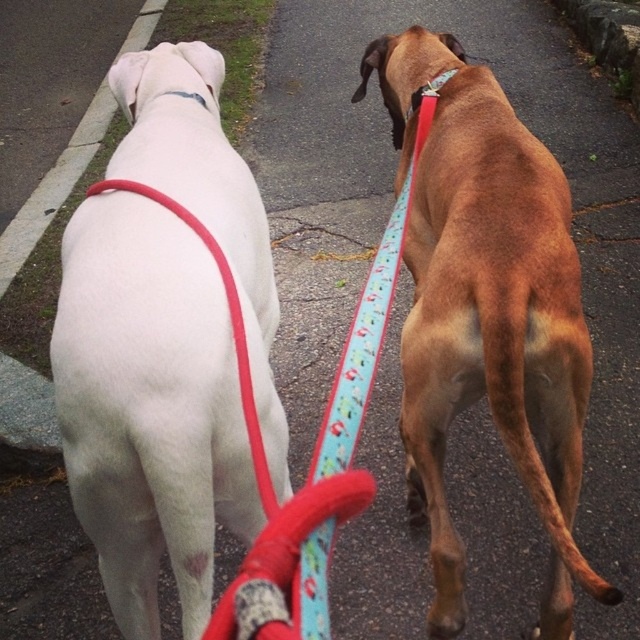
Between blue fabric leash at center and matte red collar at upper center, which one has more height?

With more height is blue fabric leash at center.

Does blue fabric leash at center have a lesser width compared to matte red collar at upper center?

No.

Between point (298, 598) and point (448, 72), which one is positioned in front?

Point (298, 598) is in front.

Identify the location of blue fabric leash at center. The height and width of the screenshot is (640, 640). tap(312, 460).

Is brown matte dog at center taller than matte red collar at upper center?

Indeed, brown matte dog at center has a greater height compared to matte red collar at upper center.

Does point (532, 138) come in front of point (449, 74)?

Yes, point (532, 138) is in front of point (449, 74).

The image size is (640, 640). I want to click on brown matte dog at center, so click(x=486, y=312).

Where is `brown matte dog at center`? The width and height of the screenshot is (640, 640). brown matte dog at center is located at coordinates (486, 312).

Measure the distance between white matte dog at left and camera.

The distance of white matte dog at left from camera is 3.80 feet.

How distant is white matte dog at left from white fabric neckband at upper center?

white matte dog at left is 20.94 inches away from white fabric neckband at upper center.

Locate an element on the screen. The width and height of the screenshot is (640, 640). white matte dog at left is located at coordinates (148, 406).

This screenshot has width=640, height=640. I want to click on white matte dog at left, so click(148, 406).